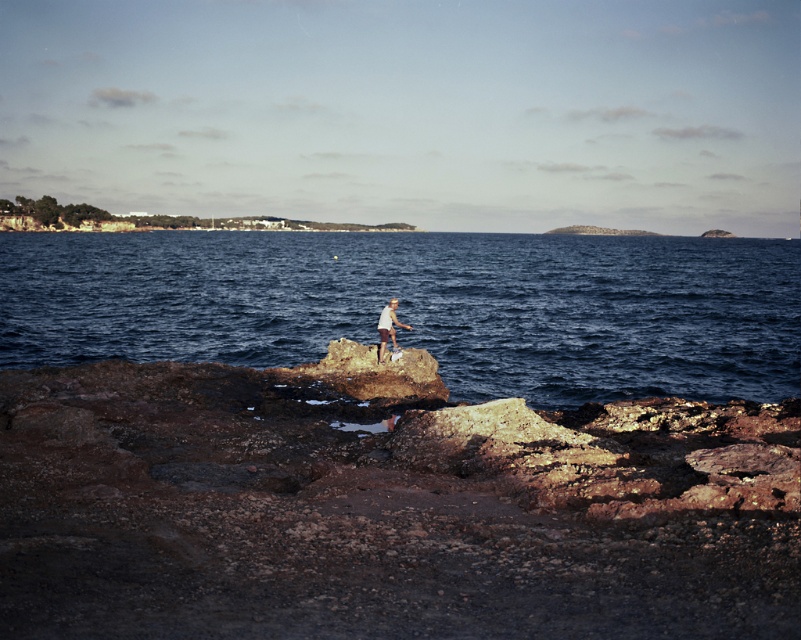
You are a photographer planning to take a landscape photo of the coastal scene. You want to ensure that both the blue water at center and the white cotton shirt at center are clearly visible in the frame. Based on their heights, which object should be positioned lower in the photo to achieve this?

The white cotton shirt at center is shorter than the blue water at center. To ensure both are visible, position the white cotton shirt at center lower in the photo so it doesn

You are a hiker who wants to take a photo of the white cotton shirt at center and the rusty rock at center. From your current position, which object is closer to the camera?

The white cotton shirt at center is closer to the camera than the rusty rock at center because the white cotton shirt at center is taller than the rusty rock at center.